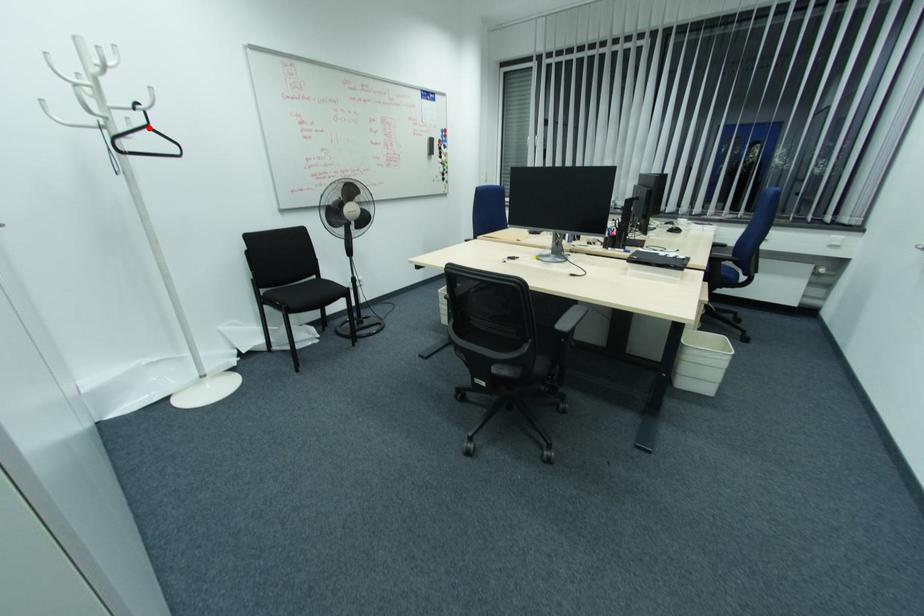
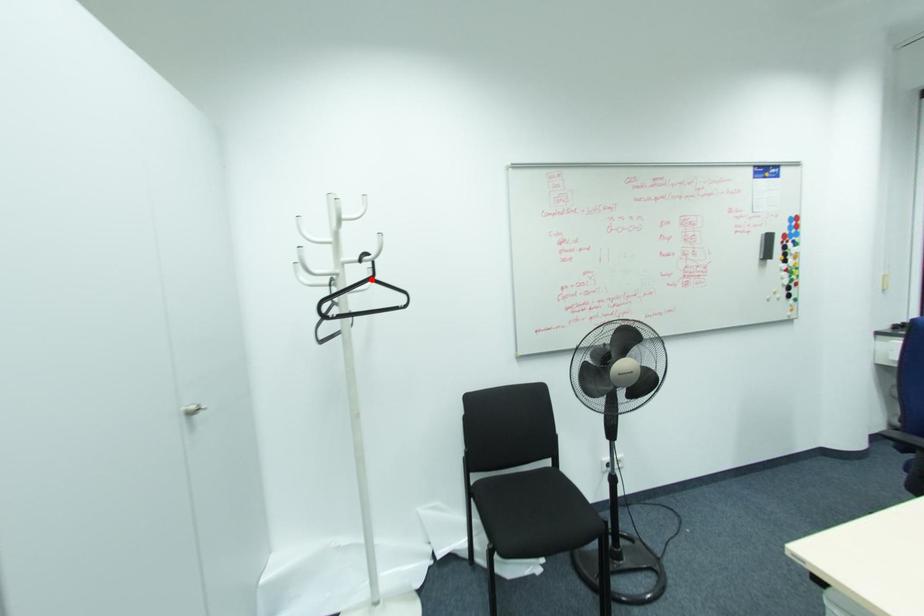
I am providing you with two images of the same scene from different viewpoints. A red point is marked on the first image and another point is marked on the second image. Does the point marked in image1 correspond to the same location as the one in image2?

Yes